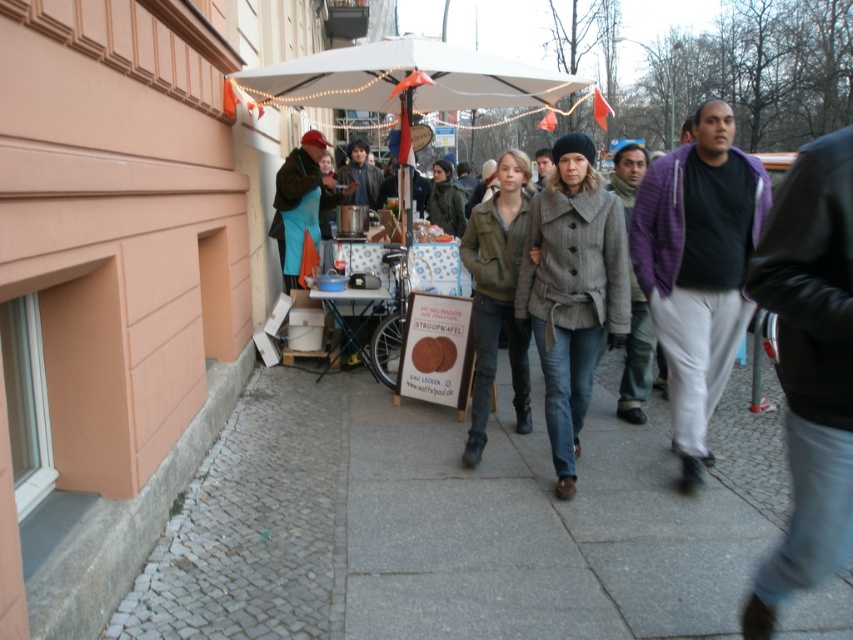
Question: Is gray cobblestone pavement at lower left behind purple fuzzy sweater at center?

Choices:
 (A) no
 (B) yes

Answer: (A)

Question: Observing the image, what is the correct spatial positioning of white fabric canopy at upper center in reference to purple fuzzy sweater at center?

Choices:
 (A) above
 (B) below

Answer: (A)

Question: Which point is closer to the camera?

Choices:
 (A) (177, 556)
 (B) (619, 412)

Answer: (A)

Question: Does purple knit sweater at center have a greater width compared to purple fuzzy sweater at center?

Choices:
 (A) no
 (B) yes

Answer: (B)

Question: Which point appears farthest from the camera in this image?

Choices:
 (A) (633, 144)
 (B) (711, 307)

Answer: (A)

Question: Which of the following is the closest to the observer?

Choices:
 (A) white fabric canopy at upper center
 (B) gray wool coat at center
 (C) gray cobblestone pavement at lower left
 (D) purple knit sweater at center

Answer: (C)